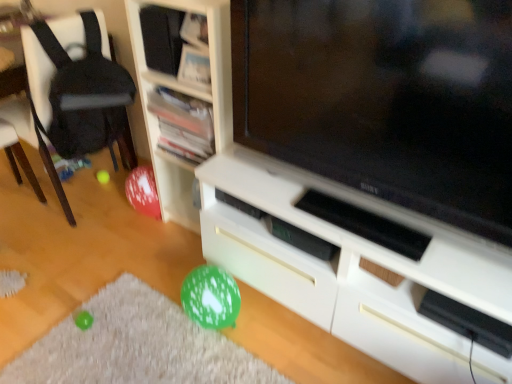
Question: Is black fabric chair at left placed right next to white wood shelf at center, marked as the third shelf in a top-to-bottom arrangement?

Choices:
 (A) no
 (B) yes

Answer: (A)

Question: Can you confirm if black fabric chair at left is positioned to the left of white wood shelf at center, positioned as the first shelf in bottom-to-top order?

Choices:
 (A) no
 (B) yes

Answer: (B)

Question: Is black fabric chair at left in front of white wood shelf at center, positioned as the first shelf in bottom-to-top order?

Choices:
 (A) yes
 (B) no

Answer: (B)

Question: From a real-world perspective, is black fabric chair at left below white wood shelf at center, marked as the third shelf in a top-to-bottom arrangement?

Choices:
 (A) no
 (B) yes

Answer: (B)

Question: Is black fabric chair at left positioned far away from white wood shelf at center, positioned as the first shelf in bottom-to-top order?

Choices:
 (A) no
 (B) yes

Answer: (A)

Question: Does black fabric chair at left lie behind white wood shelf at center, positioned as the first shelf in bottom-to-top order?

Choices:
 (A) yes
 (B) no

Answer: (A)

Question: Is matte black television at center far from wooden bookshelf at upper center, the 2th shelf when ordered from top to bottom?

Choices:
 (A) yes
 (B) no

Answer: (B)

Question: Considering the relative positions of matte black television at center and wooden bookshelf at upper center, which appears as the 2th shelf when ordered from the bottom, in the image provided, is matte black television at center behind wooden bookshelf at upper center, which appears as the 2th shelf when ordered from the bottom,?

Choices:
 (A) yes
 (B) no

Answer: (B)

Question: Considering the relative sizes of matte black television at center and wooden bookshelf at upper center, which appears as the 2th shelf when ordered from the bottom, in the image provided, is matte black television at center shorter than wooden bookshelf at upper center, which appears as the 2th shelf when ordered from the bottom,?

Choices:
 (A) no
 (B) yes

Answer: (A)

Question: Considering the relative positions of matte black television at center and wooden bookshelf at upper center, which appears as the 2th shelf when ordered from the bottom, in the image provided, is matte black television at center to the right of wooden bookshelf at upper center, which appears as the 2th shelf when ordered from the bottom, from the viewer's perspective?

Choices:
 (A) yes
 (B) no

Answer: (A)

Question: From the image's perspective, is matte black television at center located beneath wooden bookshelf at upper center, the 2th shelf when ordered from top to bottom?

Choices:
 (A) yes
 (B) no

Answer: (A)

Question: Is matte black television at center oriented away from wooden bookshelf at upper center, the 2th shelf when ordered from top to bottom?

Choices:
 (A) yes
 (B) no

Answer: (B)

Question: From the image's perspective, would you say matte black television at center is positioned over white wood shelf at center, positioned as the first shelf in bottom-to-top order?

Choices:
 (A) yes
 (B) no

Answer: (B)